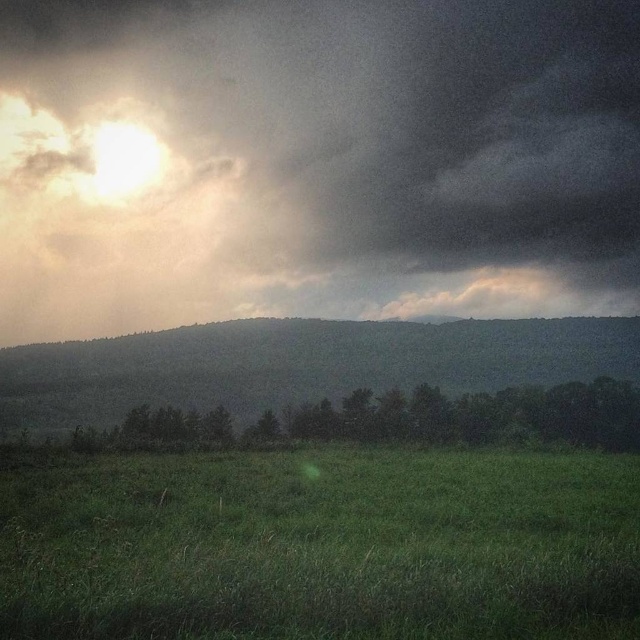
You are standing at the center of the image and want to walk towards the green grassy field at lower center. In which direction should you move?

The green grassy field at lower center is located at point 0.855 on the x and 0.503 on the y coordinates. Since you are at the center, you should move downward and slightly to the right to reach it.

You are standing in the middle of the green grassy hillside at center and want to look up at the dark cloudy sky at upper center. In which direction should you turn your head?

You should turn your head to the right to look at the dark cloudy sky at upper center since it is positioned to the right of the green grassy hillside at center.

You are standing in the middle of the green grassy hillside at center and looking towards the dark cloudy sky at upper center. Which one appears taller from your perspective?

The dark cloudy sky at upper center appears much taller than the green grassy hillside at center from your perspective.